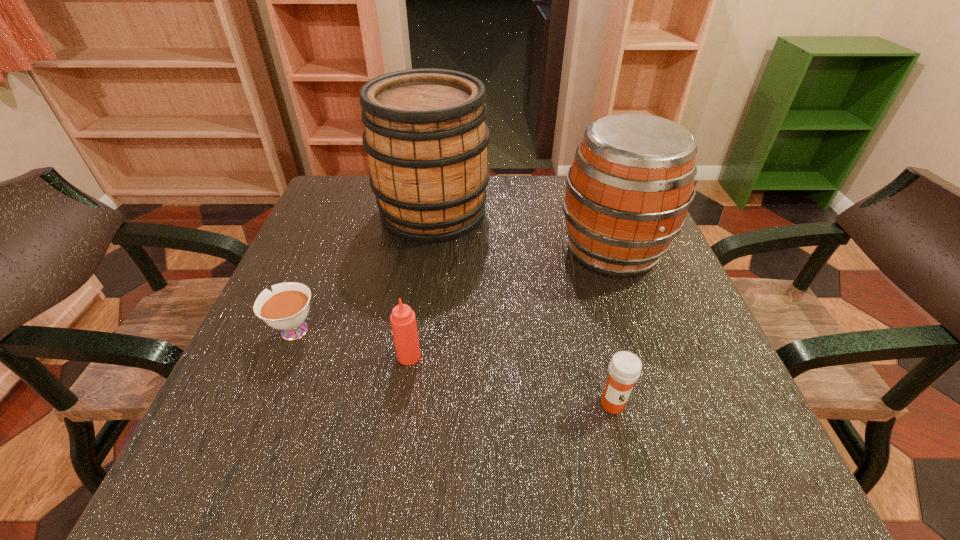
Find the location of a particular element. the left cider is located at coordinates (426, 138).

Find the location of a particular element. This screenshot has height=540, width=960. the right cider is located at coordinates (629, 189).

I want to click on Tabasco sauce, so click(403, 320).

Where is `medicine`? The width and height of the screenshot is (960, 540). medicine is located at coordinates (625, 367).

At what (x,y) coordinates should I click in order to perform the action: click on the nearest object. Please return your answer as a coordinate pair (x, y). Image resolution: width=960 pixels, height=540 pixels. Looking at the image, I should click on (625, 367).

Find the location of `the shortest object`. the shortest object is located at coordinates (286, 309).

Where is `teacup`? teacup is located at coordinates (286, 309).

This screenshot has height=540, width=960. Find the location of `vacant space situated 0.220m on the front of the left cider`. vacant space situated 0.220m on the front of the left cider is located at coordinates (419, 318).

The image size is (960, 540). What are the coordinates of `free space located 0.080m on the front of the right cider` in the screenshot? It's located at (636, 315).

Where is `vacant space located on the left of the Tabasco sauce`? The image size is (960, 540). vacant space located on the left of the Tabasco sauce is located at coordinates (364, 356).